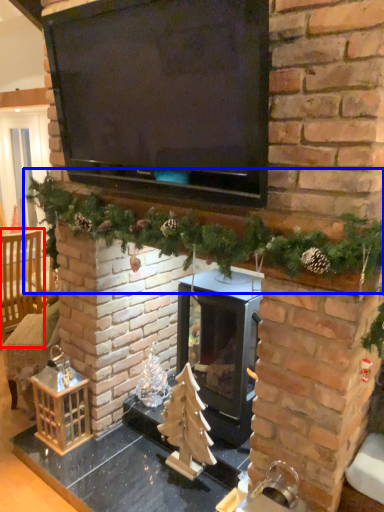
Question: Which object is further to the camera taking this photo, armchair (highlighted by a red box) or christmas decoration (highlighted by a blue box)?

Choices:
 (A) armchair
 (B) christmas decoration

Answer: (A)